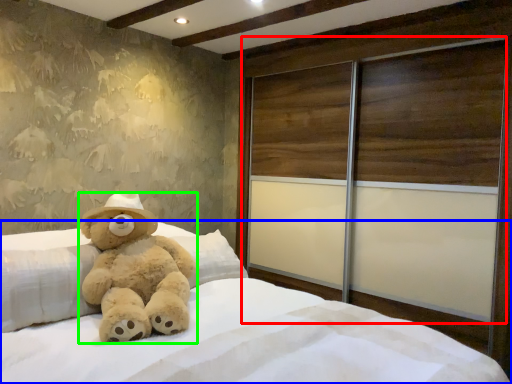
Question: Based on their relative distances, which object is nearer to screen door (highlighted by a red box)? Choose from bed (highlighted by a blue box) and teddy bear (highlighted by a green box).

Choices:
 (A) bed
 (B) teddy bear

Answer: (A)